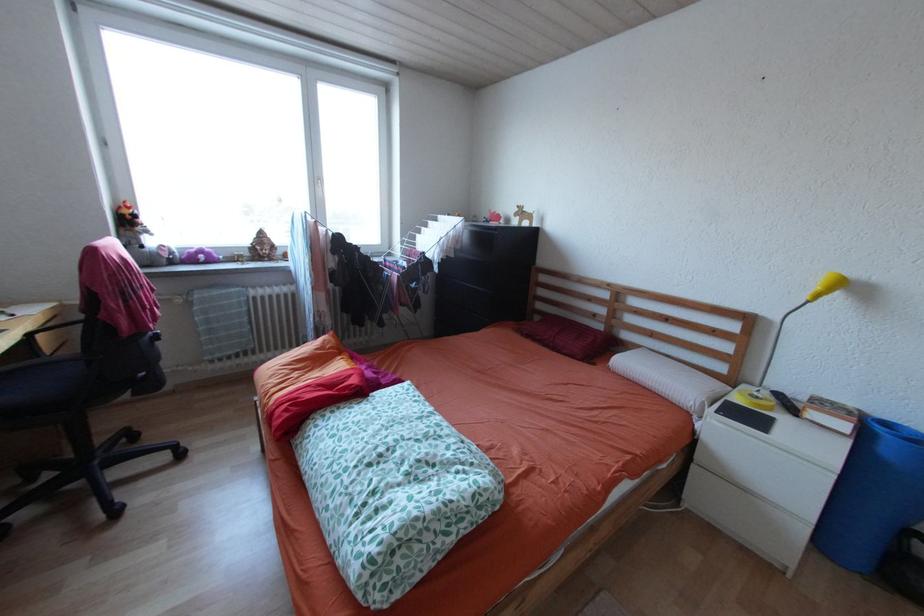
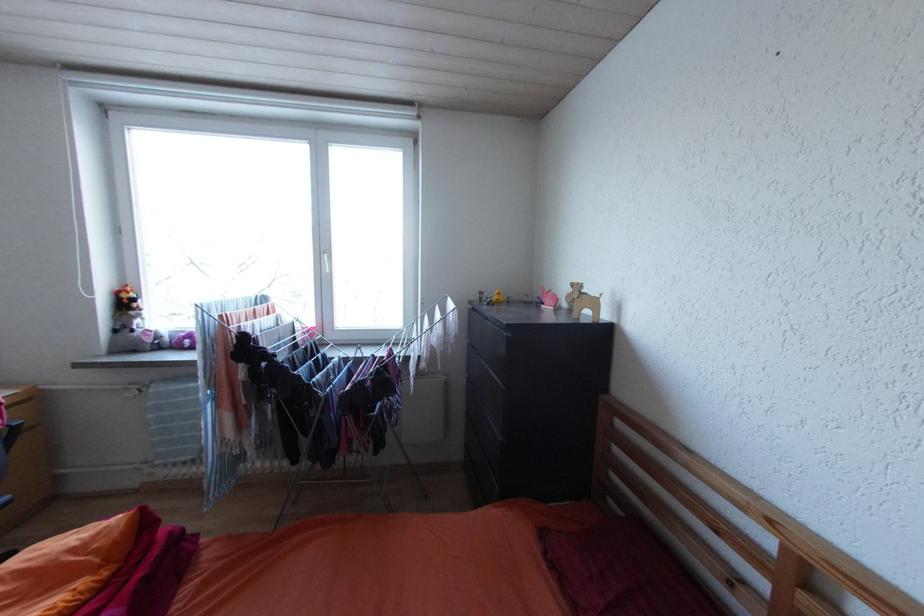
What movement of the cameraman would produce the second image?

The cameraman moved toward right, forward.